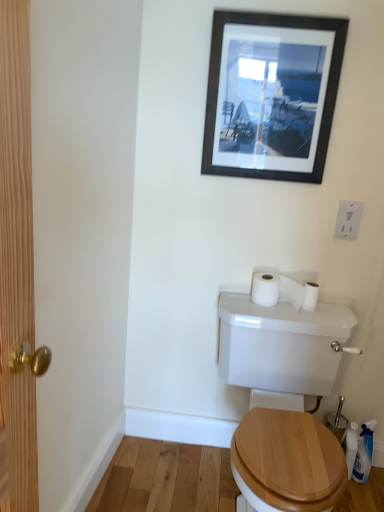
Find the location of a particular element. This screenshot has width=384, height=512. vacant area in front of white matte toilet paper at upper right, positioned as the first toilet paper in right-to-left order is located at coordinates (312, 319).